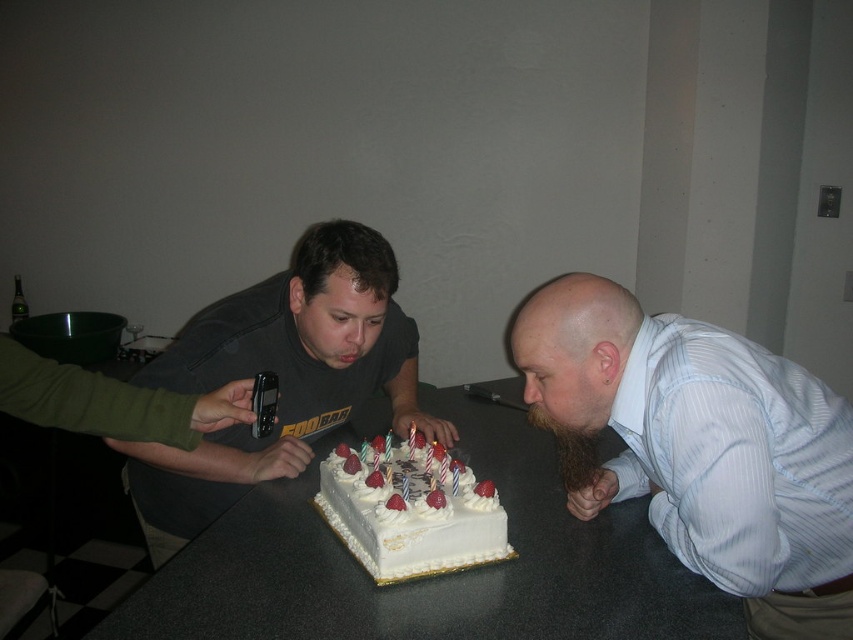
Question: Estimate the real-world distances between objects in this image. Which object is closer to the white glossy table at center?

Choices:
 (A) dark gray t-shirt at center
 (B) white frosted cake at center

Answer: (B)

Question: Estimate the real-world distances between objects in this image. Which object is closer to the white frosted cake at center?

Choices:
 (A) light blue striped shirt at lower right
 (B) dark gray t-shirt at center

Answer: (B)

Question: Which point appears closest to the camera in this image?

Choices:
 (A) (341, 285)
 (B) (549, 314)
 (C) (329, 520)

Answer: (B)

Question: Considering the relative positions of light blue striped shirt at lower right and white frosted cake at center in the image provided, where is light blue striped shirt at lower right located with respect to white frosted cake at center?

Choices:
 (A) above
 (B) below

Answer: (A)

Question: Does light blue striped shirt at lower right have a lesser width compared to white frosted cake at center?

Choices:
 (A) no
 (B) yes

Answer: (A)

Question: Can you confirm if white glossy table at center is positioned to the left of white frosted cake at center?

Choices:
 (A) no
 (B) yes

Answer: (A)